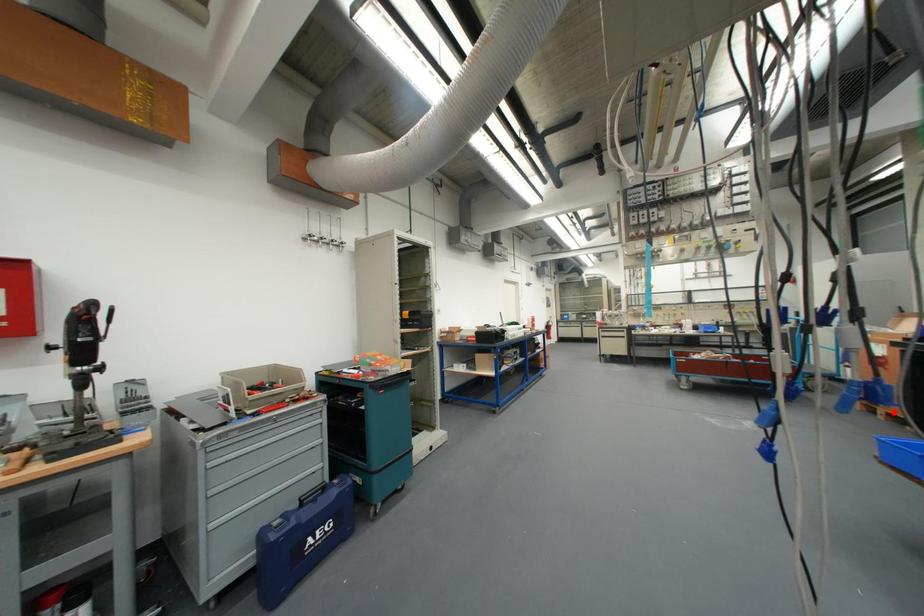
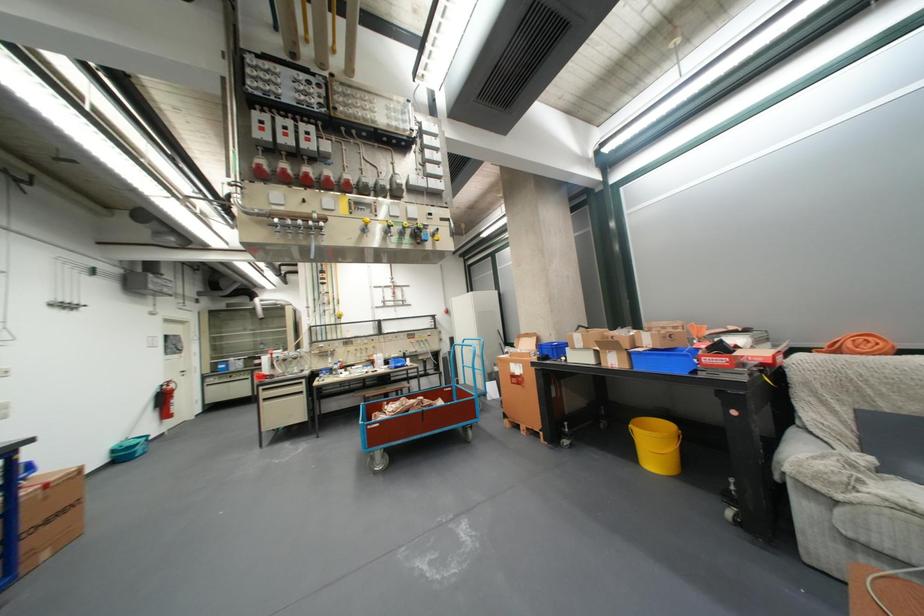
Question: I am providing you with two images of the same scene from different viewpoints. Image1 has a red point marked. In image2, the corresponding 3D location appears at what relative position? Reply with the corresponding letter.

Choices:
 (A) Closer
 (B) Farther

Answer: (A)